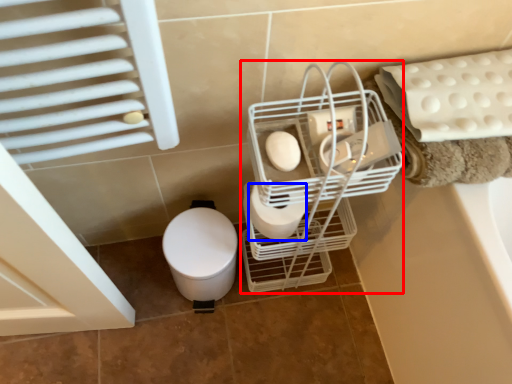
Question: Which object appears farthest to the camera in this image, trolley (highlighted by a red box) or toilet paper (highlighted by a blue box)?

Choices:
 (A) trolley
 (B) toilet paper

Answer: (B)